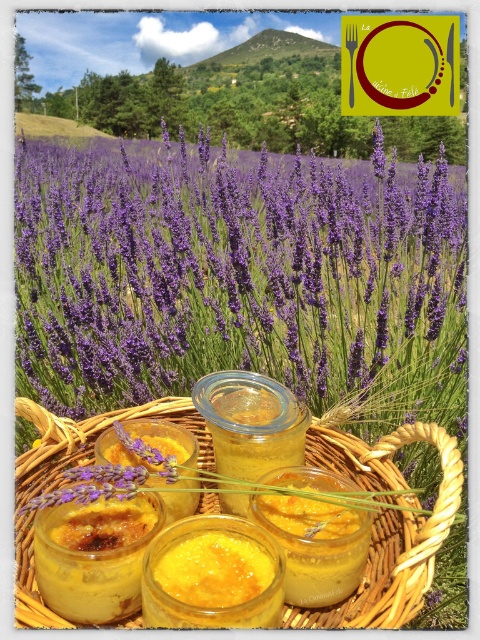
In the scene shown: You are a photographer positioned at the edge of the lavender field. You want to take a photo of both the woven straw basket at center and the transparent glass jar at center. Which object should you focus on first to ensure both are in sharp focus?

You should focus on the woven straw basket at center first because it is closer to you than the transparent glass jar at center, so adjusting focus from near to far will help both objects be in sharp focus.

You are holding a 12 inch ruler. Can you reach the point at coordinates point (385, 556) with your ruler if you are standing at your current position?

The point at coordinates point (385, 556) is 25.27 inches away from you. Since your ruler is only 12 inches long, you cannot reach it with the ruler.

You are a chef who wants to place the transparent glass jar at center onto the woven straw basket at center. Based on the scene, will the jar fit securely on the basket?

The woven straw basket at center is positioned under the transparent glass jar at center, so yes, the jar can fit securely on the basket as the basket is placed underneath it.